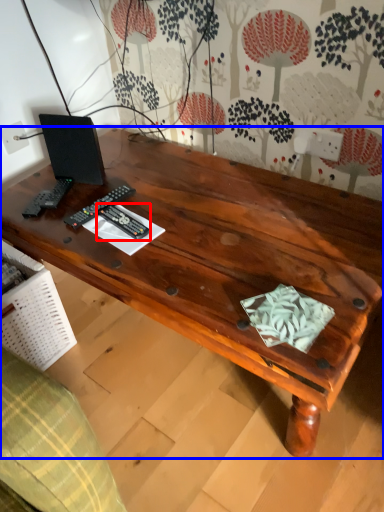
Question: Among these objects, which one is farthest to the camera, control (highlighted by a red box) or desk (highlighted by a blue box)?

Choices:
 (A) control
 (B) desk

Answer: (A)